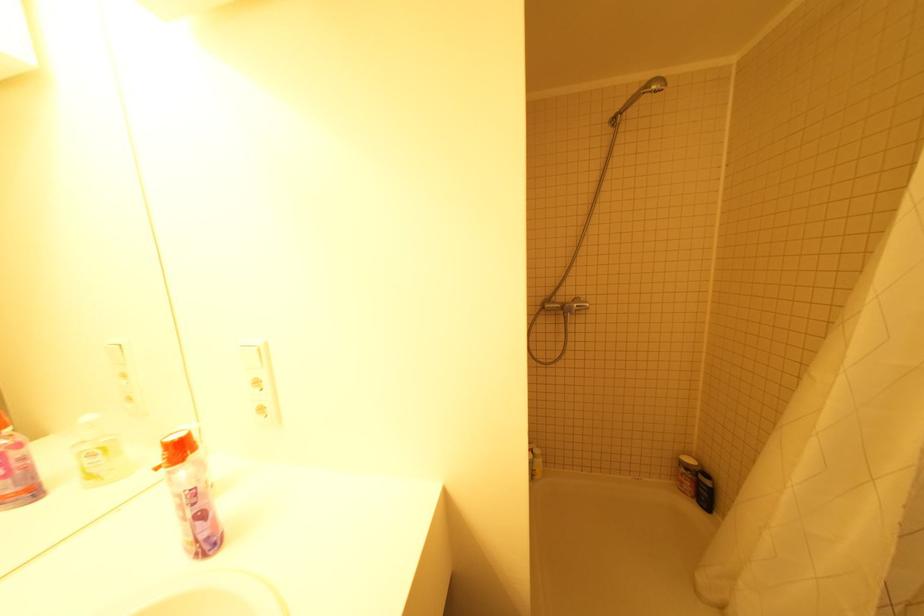
Which object does [704,491] point to?

It refers to a dark shampoo bottle.